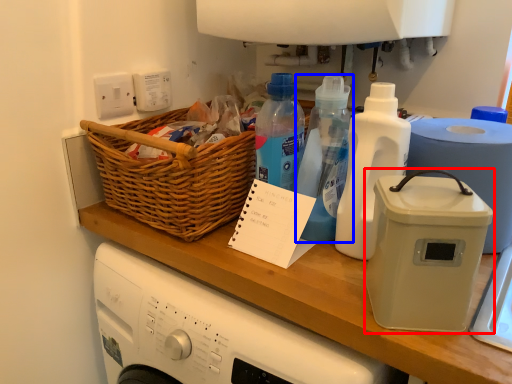
Question: Which object appears farthest to the camera in this image, kitchen appliance (highlighted by a red box) or bottle (highlighted by a blue box)?

Choices:
 (A) kitchen appliance
 (B) bottle

Answer: (B)